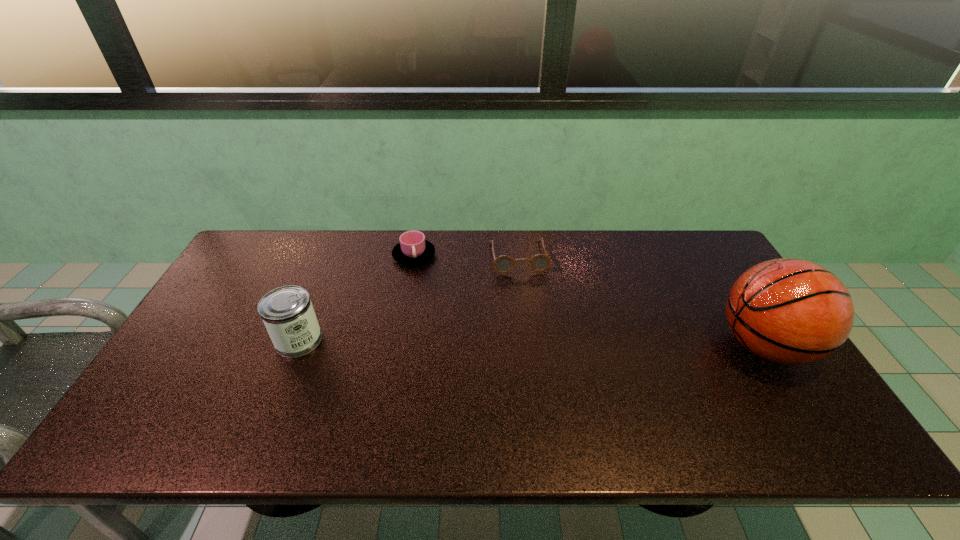
Identify the location of object at the near right corner. (789, 311).

Locate an element on the screen. This screenshot has height=540, width=960. vacant space at the far edge is located at coordinates (572, 264).

In the image, there is a desktop. At what (x,y) coordinates should I click in order to perform the action: click on vacant region at the near edge. Please return your answer as a coordinate pair (x, y). Looking at the image, I should click on (225, 397).

In the image, there is a desktop. Identify the location of vacant space at the left edge. (239, 286).

Identify the location of vacant space at the right edge of the desktop. (711, 285).

Locate an element on the screen. This screenshot has height=540, width=960. free spot at the near left corner of the desktop is located at coordinates (159, 409).

This screenshot has height=540, width=960. Find the location of `vacant point located between the basketball and the cup`. vacant point located between the basketball and the cup is located at coordinates (589, 300).

The width and height of the screenshot is (960, 540). I want to click on free space between the cup and the basketball, so click(589, 300).

Locate an element on the screen. Image resolution: width=960 pixels, height=540 pixels. free point between the basketball and the second object from left to right is located at coordinates (589, 300).

You are a GUI agent. You are given a task and a screenshot of the screen. Output one action in this format:
    pyautogui.click(x=<x>, y=<y>)
    Task: Click on the vacant space in between the cup and the third shortest object
    This screenshot has width=960, height=540.
    Given the screenshot: What is the action you would take?
    pyautogui.click(x=356, y=298)